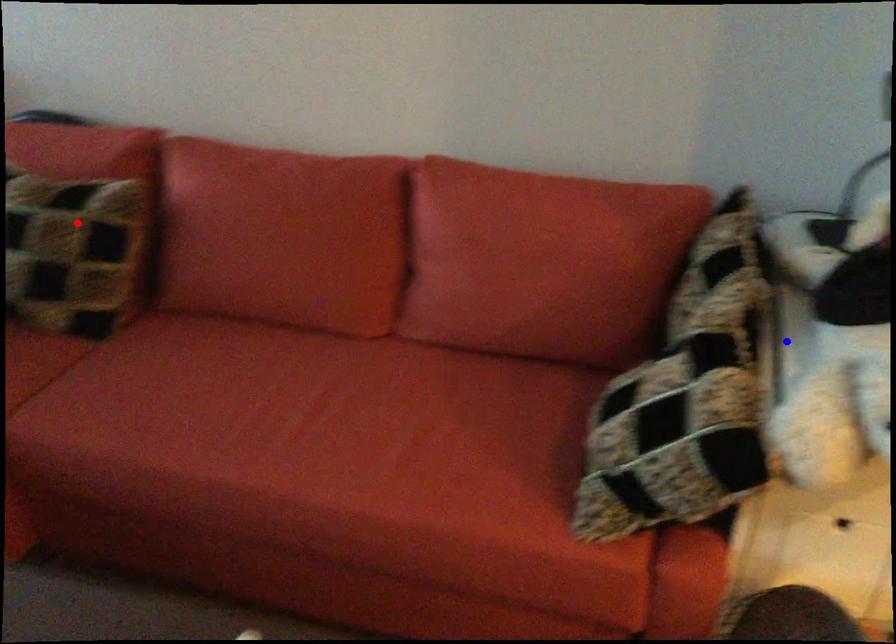
Question: Two points are marked on the image. Which point is closer to the camera?

Choices:
 (A) Blue point is closer.
 (B) Red point is closer.

Answer: (A)